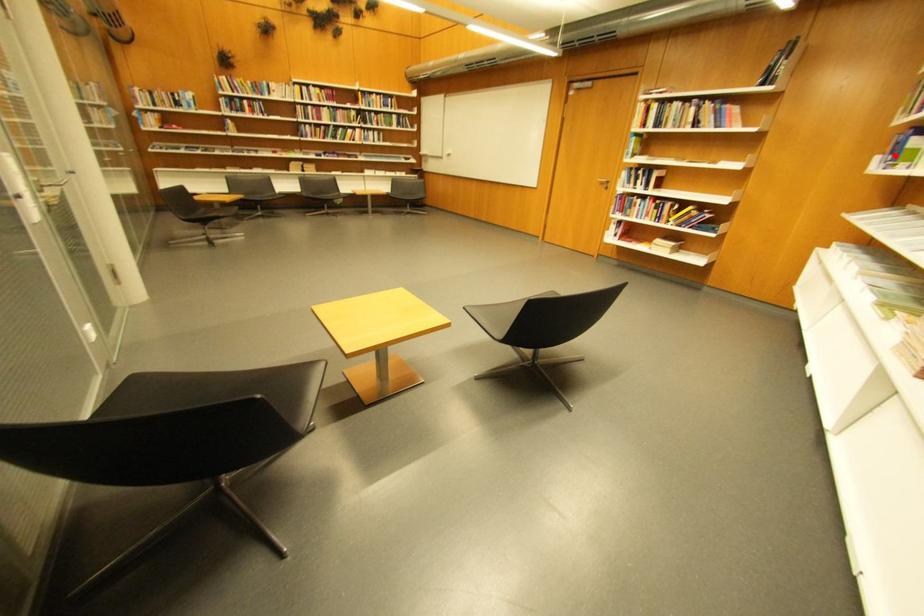
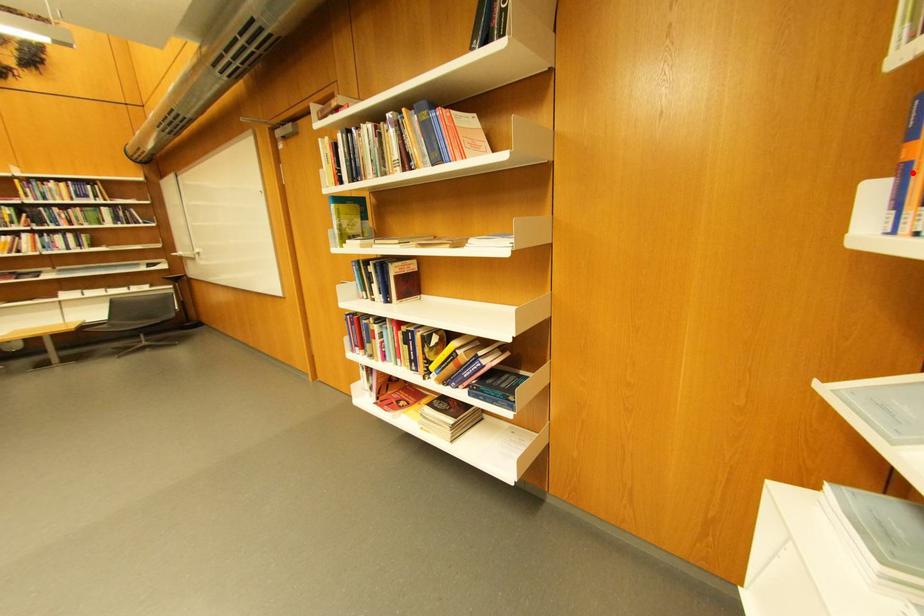
I am providing you with two images of the same scene from different viewpoints. A red point is marked on the first image and another point is marked on the second image. Does the point marked in image1 correspond to the same location as the one in image2?

Yes